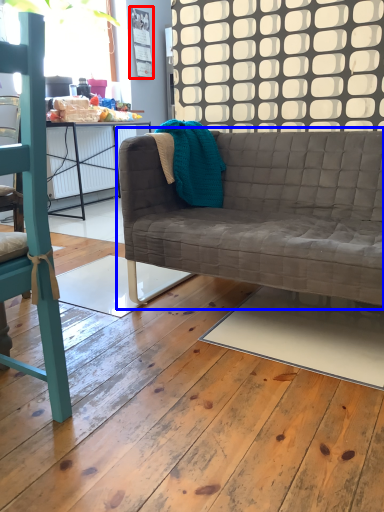
Question: Among these objects, which one is farthest to the camera, bulletin board (highlighted by a red box) or studio couch (highlighted by a blue box)?

Choices:
 (A) bulletin board
 (B) studio couch

Answer: (A)